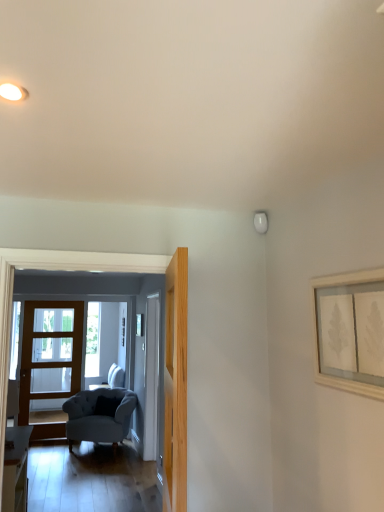
Question: Is wooden glass door at left, which ranks as the 1th door in left-to-right order, at the left side of light gray fabric armchair at left?

Choices:
 (A) no
 (B) yes

Answer: (B)

Question: Does wooden glass door at left, arranged as the 3th door when viewed from the right, come in front of light gray fabric armchair at left?

Choices:
 (A) no
 (B) yes

Answer: (A)

Question: Considering the relative sizes of wooden glass door at left, arranged as the 3th door when viewed from the right, and light gray fabric armchair at left in the image provided, is wooden glass door at left, arranged as the 3th door when viewed from the right, shorter than light gray fabric armchair at left?

Choices:
 (A) yes
 (B) no

Answer: (B)

Question: From a real-world perspective, does wooden glass door at left, arranged as the 3th door when viewed from the right, sit lower than light gray fabric armchair at left?

Choices:
 (A) no
 (B) yes

Answer: (B)

Question: Is wooden glass door at left, which ranks as the first door in back-to-front order, not inside light gray fabric armchair at left?

Choices:
 (A) yes
 (B) no

Answer: (A)

Question: Can you confirm if wooden glass door at left, marked as the third door in a front-to-back arrangement, is wider than light gray fabric armchair at left?

Choices:
 (A) yes
 (B) no

Answer: (B)

Question: Is suede-like gray armchair at lower left beside white glossy door at center, the 2th door from the front?

Choices:
 (A) no
 (B) yes

Answer: (A)

Question: Considering the relative sizes of suede-like gray armchair at lower left and white glossy door at center, the 2th door from the front, in the image provided, is suede-like gray armchair at lower left smaller than white glossy door at center, the 2th door from the front,?

Choices:
 (A) yes
 (B) no

Answer: (B)

Question: Are suede-like gray armchair at lower left and white glossy door at center, the 2th door from the front, far apart?

Choices:
 (A) no
 (B) yes

Answer: (A)

Question: Can we say suede-like gray armchair at lower left lies outside white glossy door at center, which ranks as the second door in right-to-left order?

Choices:
 (A) no
 (B) yes

Answer: (B)

Question: Is suede-like gray armchair at lower left shorter than white glossy door at center, arranged as the 2th door when viewed from the left?

Choices:
 (A) no
 (B) yes

Answer: (B)

Question: From the image's perspective, is suede-like gray armchair at lower left over white glossy door at center, the 2th door from the front?

Choices:
 (A) no
 (B) yes

Answer: (A)

Question: Is the surface of white glossy door at center, which ranks as the second door in right-to-left order, in direct contact with suede-like gray armchair at lower left?

Choices:
 (A) no
 (B) yes

Answer: (A)